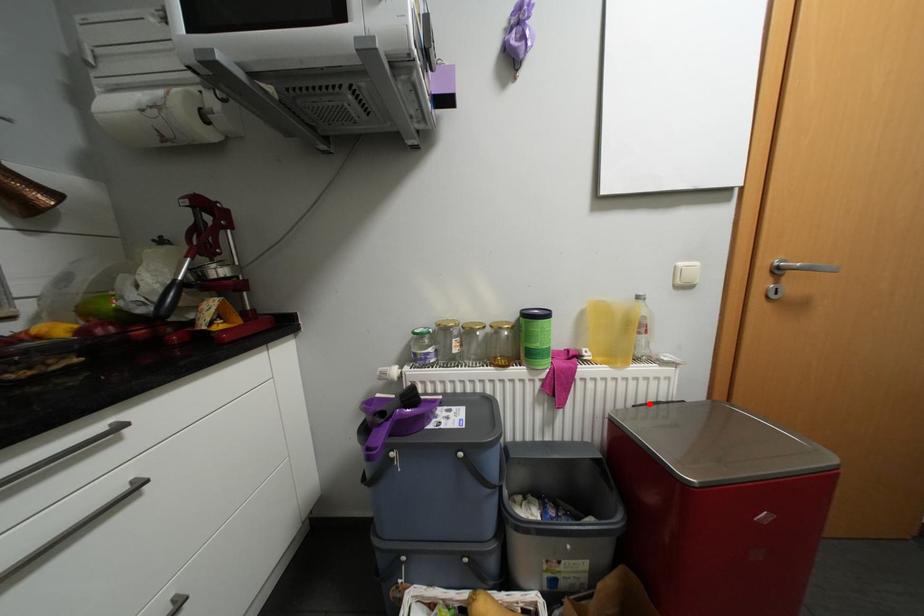
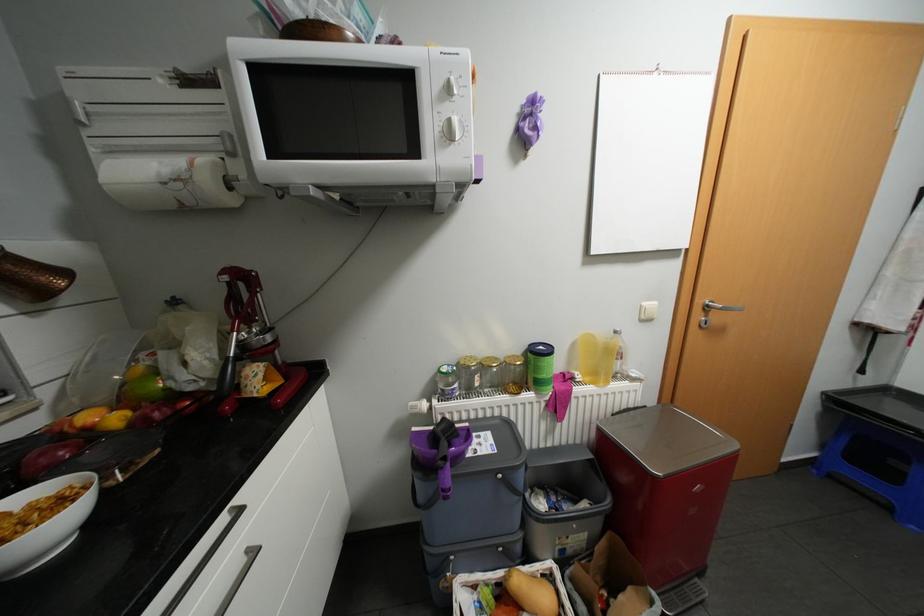
The point at the highlighted location is marked in the first image. Where is the corresponding point in the second image?

(626, 411)